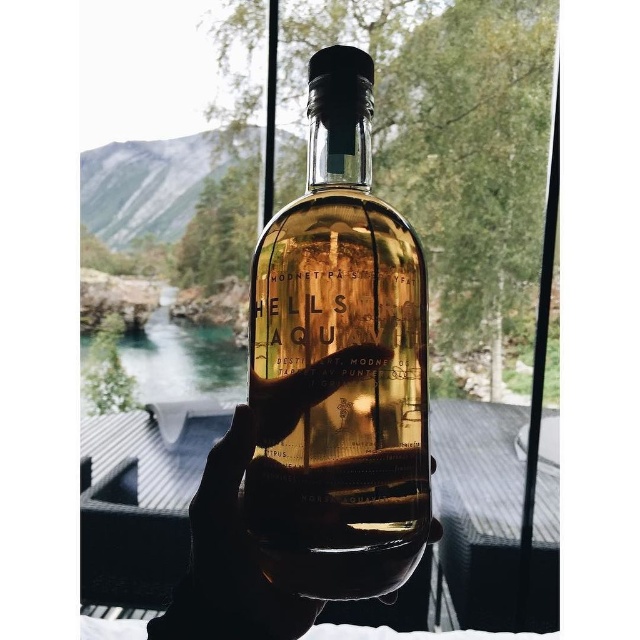
Question: Which point appears farthest from the camera in this image?

Choices:
 (A) (310, 600)
 (B) (360, 468)

Answer: (A)

Question: Among these objects, which one is nearest to the camera?

Choices:
 (A) translucent glass bottle at center
 (B) translucent amber glass bottle at center

Answer: (A)

Question: Does translucent amber glass bottle at center have a lesser width compared to translucent glass bottle at center?

Choices:
 (A) no
 (B) yes

Answer: (B)

Question: Does translucent amber glass bottle at center appear under translucent glass bottle at center?

Choices:
 (A) no
 (B) yes

Answer: (A)

Question: Does translucent amber glass bottle at center have a smaller size compared to translucent glass bottle at center?

Choices:
 (A) no
 (B) yes

Answer: (A)

Question: Which object appears farthest from the camera in this image?

Choices:
 (A) translucent amber glass bottle at center
 (B) translucent glass bottle at center

Answer: (A)